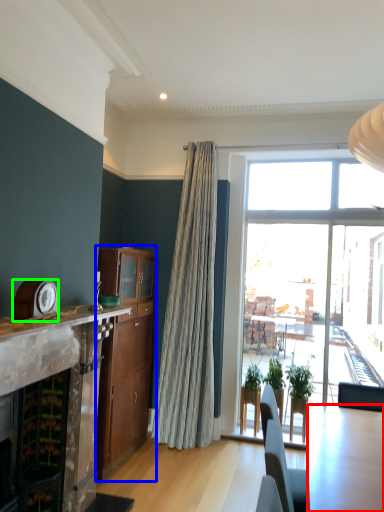
Question: Which object is the farthest from kitchen & dining room table (highlighted by a red box)? Choose among these: cabinetry (highlighted by a blue box) or clock (highlighted by a green box).

Choices:
 (A) cabinetry
 (B) clock

Answer: (A)